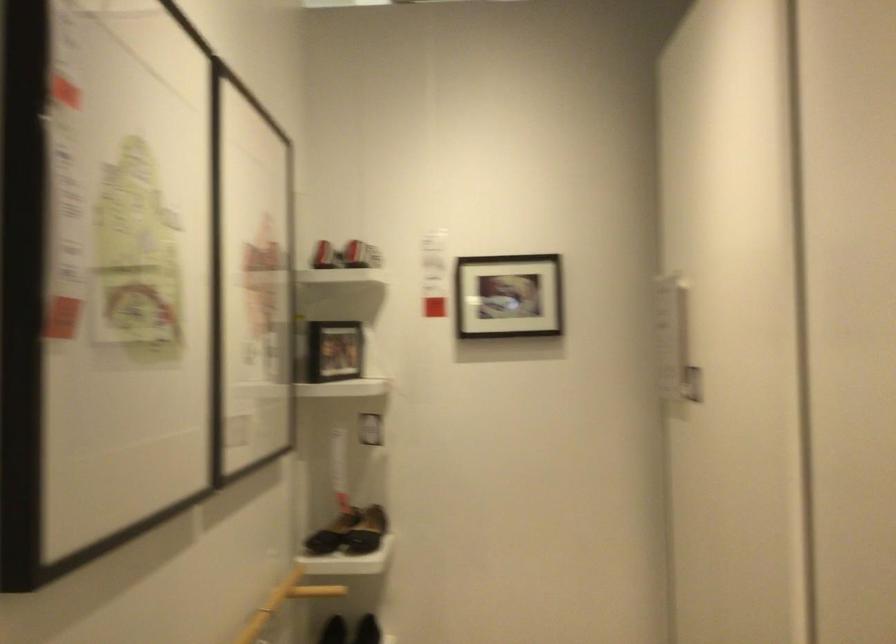
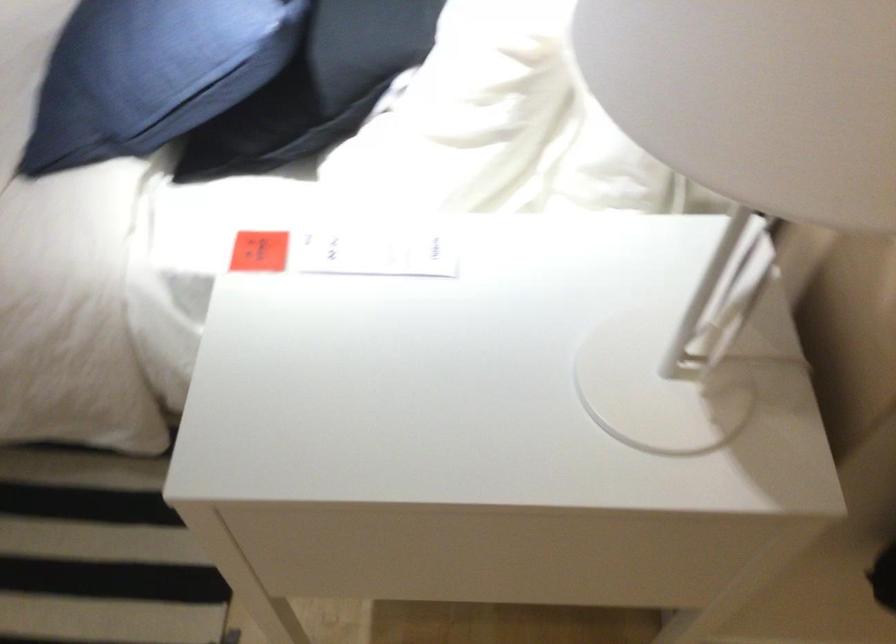
First-person continuous shooting, in which direction is the camera rotating?

The camera's rotation is toward left-down.